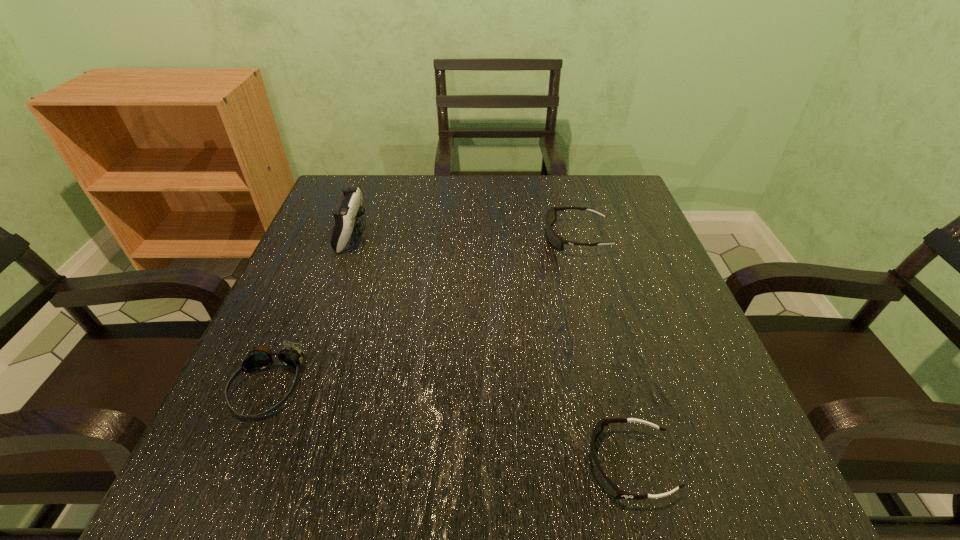
Locate an element on the screen. free space located through the lenses of the second farthest goggles is located at coordinates (241, 452).

Locate an element on the screen. This screenshot has height=540, width=960. free region located 0.140m on the front and sides of the shortest goggles is located at coordinates (489, 464).

Locate an element on the screen. free space located on the front and sides of the shortest goggles is located at coordinates (419, 464).

Image resolution: width=960 pixels, height=540 pixels. Find the location of `vacant region located on the front and sides of the shortest goggles`. vacant region located on the front and sides of the shortest goggles is located at coordinates (523, 464).

The width and height of the screenshot is (960, 540). I want to click on control at the far edge, so click(346, 217).

Find the location of `goggles at the far edge`. goggles at the far edge is located at coordinates (555, 240).

Find the location of a particular element. The width and height of the screenshot is (960, 540). object that is at the near edge is located at coordinates (612, 489).

Locate an element on the screen. control at the left edge is located at coordinates (346, 217).

Locate an element on the screen. The height and width of the screenshot is (540, 960). goggles that is at the left edge is located at coordinates (259, 357).

This screenshot has height=540, width=960. Identify the location of object that is positioned at the far left corner. (346, 217).